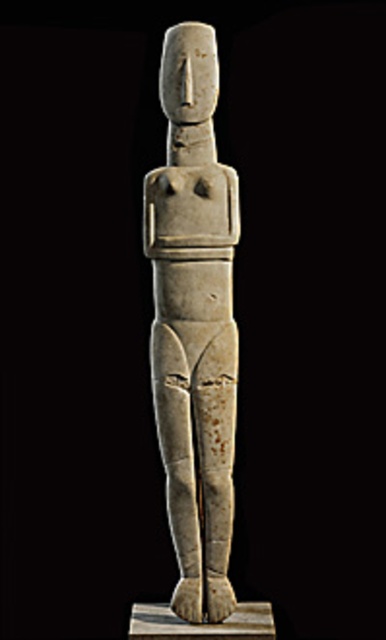
Who is shorter, white stone figure at center or white stone pillar at center?

white stone pillar at center

Can you confirm if white stone figure at center is wider than white stone pillar at center?

Incorrect, white stone figure at center's width does not surpass white stone pillar at center's.

From the picture: Who is more forward, [206,445] or [198,637]?

Point [198,637]

Identify the location of white stone figure at center. Image resolution: width=386 pixels, height=640 pixels. (194, 349).